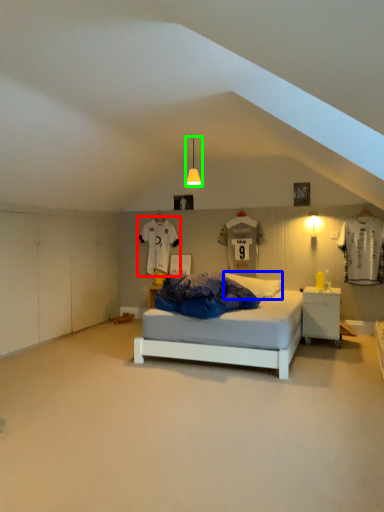
Question: Which is farther away from t shirt (highlighted by a red box)? pillow (highlighted by a blue box) or light fixture (highlighted by a green box)?

Choices:
 (A) pillow
 (B) light fixture

Answer: (A)